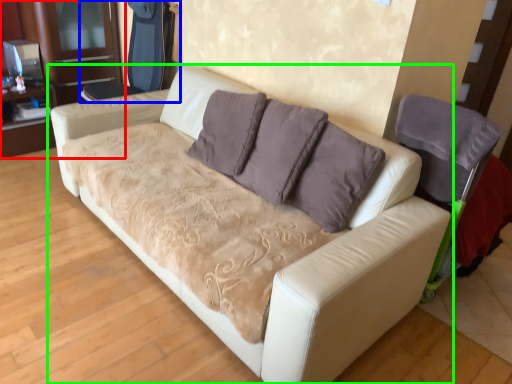
Question: Which object is positioned farthest from dresser (highlighted by a red box)? Select from armchair (highlighted by a blue box) and studio couch (highlighted by a green box).

Choices:
 (A) armchair
 (B) studio couch

Answer: (B)